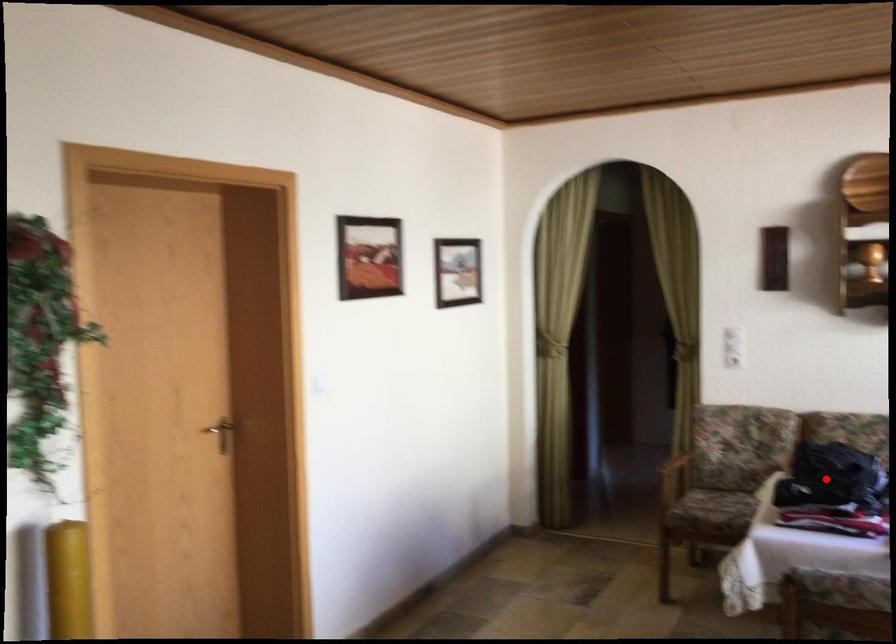
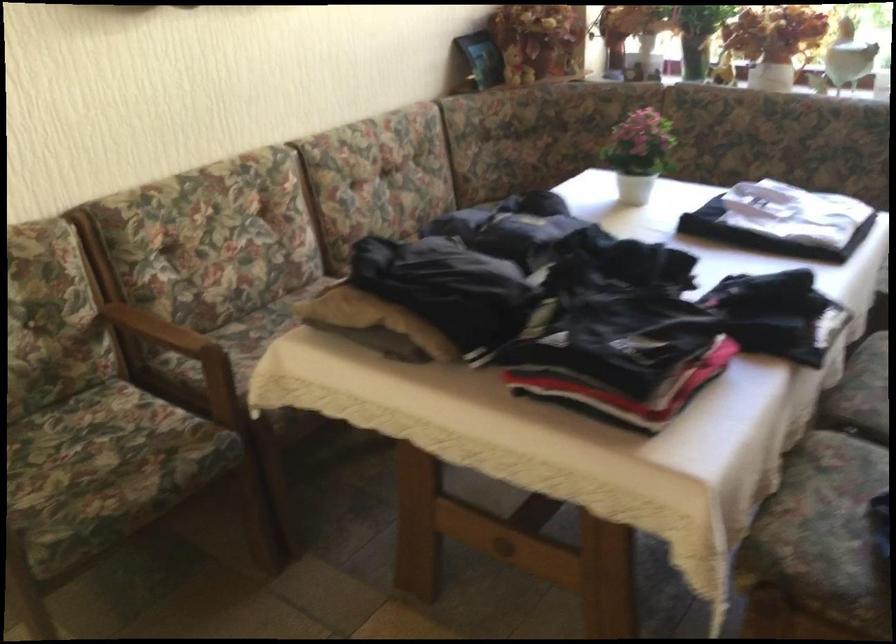
The point at the highlighted location is marked in the first image. Where is the corresponding point in the second image?

(589, 317)